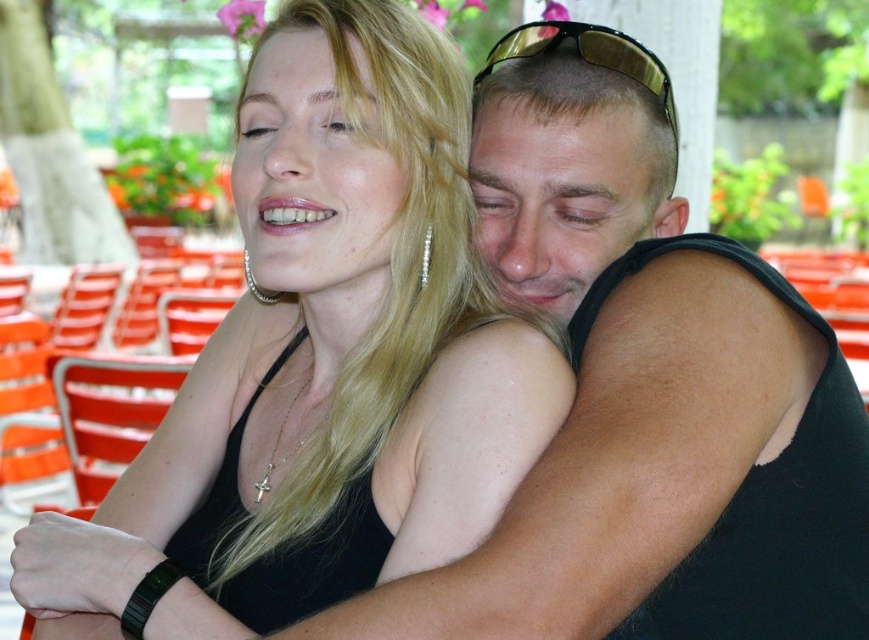
Can you confirm if black matte tank top at center is wider than gold reflective sunglasses at upper center?

Indeed, black matte tank top at center has a greater width compared to gold reflective sunglasses at upper center.

Based on the photo, between black matte tank top at center and gold reflective sunglasses at upper center, which one has more height?

black matte tank top at center

Find the location of a particular element. This screenshot has width=869, height=640. black matte tank top at center is located at coordinates (323, 362).